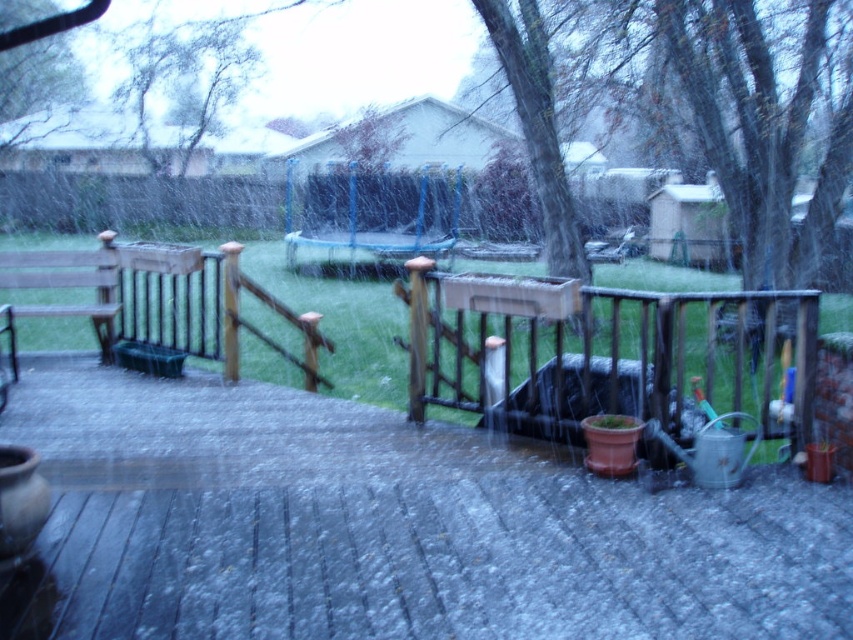
Question: Which is nearer to the wooden bench at left?

Choices:
 (A) smooth wooden deck at center
 (B) wooden at right

Answer: (A)

Question: Estimate the real-world distances between objects in this image. Which object is closer to the wooden at right?

Choices:
 (A) wooden bench at left
 (B) smooth wooden deck at center

Answer: (B)

Question: Does smooth wooden deck at center have a greater width compared to wooden at right?

Choices:
 (A) yes
 (B) no

Answer: (A)

Question: Which is nearer to the wooden bench at left?

Choices:
 (A) wooden at right
 (B) smooth wooden deck at center

Answer: (B)

Question: Does smooth wooden deck at center have a larger size compared to wooden at right?

Choices:
 (A) no
 (B) yes

Answer: (B)

Question: Can you confirm if smooth wooden deck at center is wider than wooden bench at left?

Choices:
 (A) no
 (B) yes

Answer: (A)